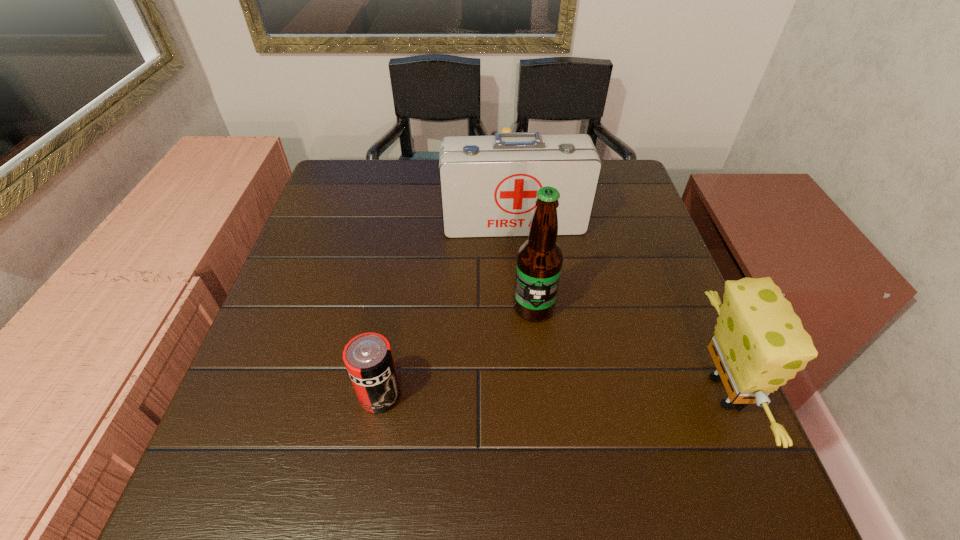
Identify the location of the leftmost object. This screenshot has width=960, height=540. (368, 358).

You are a GUI agent. You are given a task and a screenshot of the screen. Output one action in this format:
    pyautogui.click(x=<x>, y=<y>)
    Task: Click on the second shortest object
    
    Given the screenshot: What is the action you would take?
    tap(368, 358)

What are the coordinates of `the rightmost object` in the screenshot? It's located at (759, 343).

The height and width of the screenshot is (540, 960). Identify the location of the second farthest object. (488, 184).

Find the location of a particular element. The image size is (960, 540). Lego is located at coordinates (505, 130).

In order to click on the shortest object in this screenshot , I will do `click(505, 130)`.

Locate an element on the screen. the third farthest object is located at coordinates (539, 260).

The image size is (960, 540). I want to click on the tallest object, so click(539, 260).

You are a GUI agent. You are given a task and a screenshot of the screen. Output one action in this format:
    pyautogui.click(x=<x>, y=<y>)
    Task: Click on the free region located 0.330m on the right of the can
    
    Given the screenshot: What is the action you would take?
    pyautogui.click(x=575, y=395)

Where is `blank area located 0.280m on the front-facing side of the fourth nearest object`? This screenshot has height=540, width=960. blank area located 0.280m on the front-facing side of the fourth nearest object is located at coordinates (530, 323).